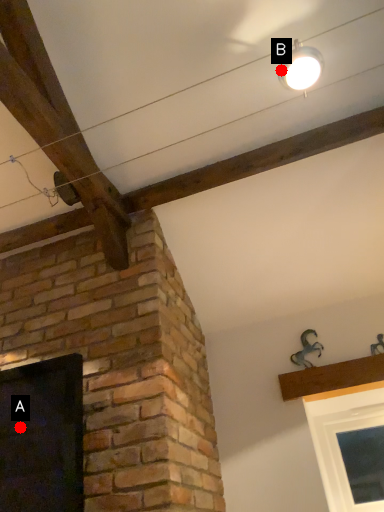
Question: Two points are circled on the image, labeled by A and B beside each circle. Which point appears closest to the camera in this image?

Choices:
 (A) A is closer
 (B) B is closer

Answer: (B)